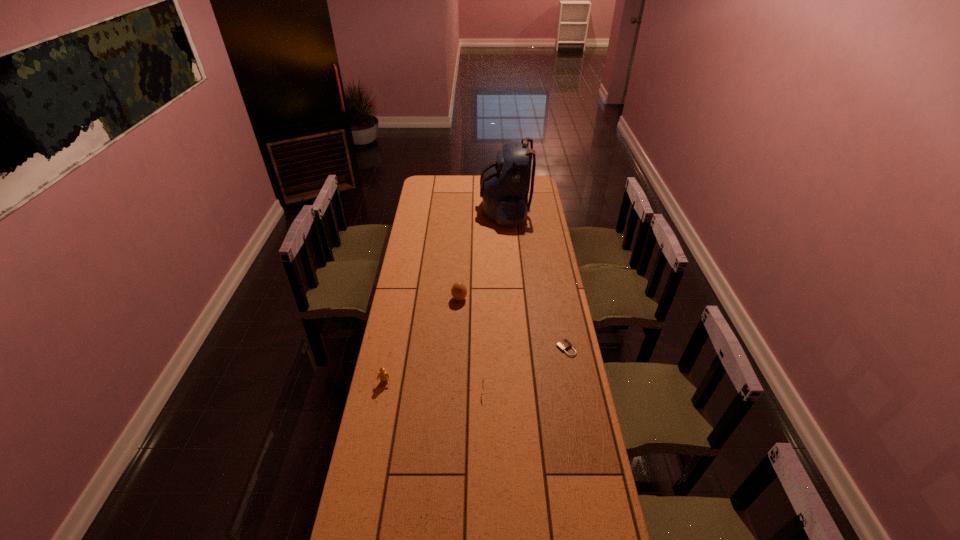
This screenshot has width=960, height=540. In order to click on vacant area that lies between the leftmost object and the second shortest object in this screenshot , I will do `click(437, 387)`.

Locate an element on the screen. The height and width of the screenshot is (540, 960). free spot between the boiled egg and the leftmost object is located at coordinates (422, 340).

Find the location of `free spot between the backpack and the padlock`. free spot between the backpack and the padlock is located at coordinates (536, 279).

At what (x,y) coordinates should I click in order to perform the action: click on free spot between the Lego and the padlock. Please return your answer as a coordinate pair (x, y). Looking at the image, I should click on (475, 366).

You are a GUI agent. You are given a task and a screenshot of the screen. Output one action in this format:
    pyautogui.click(x=<x>, y=<y>)
    Task: Click on the vacant space that is in between the tallest object and the shortest object
    
    Given the screenshot: What is the action you would take?
    pyautogui.click(x=536, y=279)

Identify the location of vacant area between the shortest object and the Lego. (475, 366).

Locate an element on the screen. Image resolution: width=960 pixels, height=540 pixels. blank region between the fourth shortest object and the backpack is located at coordinates (482, 254).

Identify which object is the closest to the tallest object. Please provide its 2D coordinates. Your answer should be formatted as a tuple, i.e. [(x, y)], where the tuple contains the x and y coordinates of a point satisfying the conditions above.

[(458, 291)]

Point out which object is positioned as the third nearest to the Lego. Please provide its 2D coordinates. Your answer should be formatted as a tuple, i.e. [(x, y)], where the tuple contains the x and y coordinates of a point satisfying the conditions above.

[(564, 344)]

What are the coordinates of `blank area in the image that satisfies the following two spatial constraints: 1. on the front side of the third nearest object; 2. in front of the lenses of the sunglasses` in the screenshot? It's located at (574, 390).